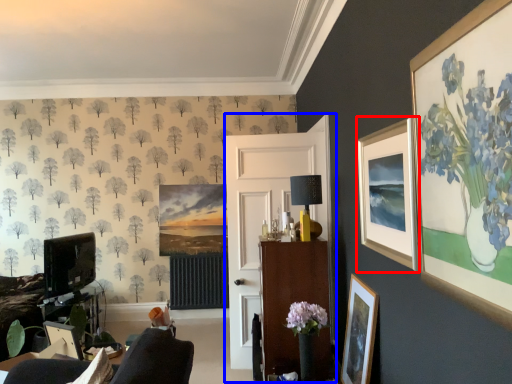
Question: Among these objects, which one is nearest to the camera, picture frame (highlighted by a red box) or side (highlighted by a blue box)?

Choices:
 (A) picture frame
 (B) side

Answer: (A)